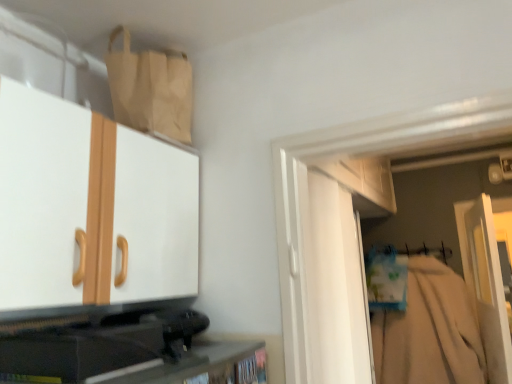
I want to click on white fabric hanger at right, so click(411, 251).

At what (x,y) coordinates should I click in order to perform the action: click on beige cotton robe at right. Please return your answer as a coordinate pair (x, y). Looking at the image, I should click on (429, 331).

This screenshot has width=512, height=384. What do you see at coordinates (197, 366) in the screenshot? I see `black plastic speaker at lower left, the 2th cabinetry from the top` at bounding box center [197, 366].

Measure the distance between black plastic speaker at lower left, acting as the first cabinetry starting from the bottom, and camera.

A distance of 29.51 inches exists between black plastic speaker at lower left, acting as the first cabinetry starting from the bottom, and camera.

Find the location of a particular element. The image size is (512, 384). white matte door at center is located at coordinates (485, 283).

The height and width of the screenshot is (384, 512). Identify the location of white fabric hanger at right. (411, 251).

From the image's perspective, between white matte door at center and black plastic speaker at lower left, acting as the first cabinetry starting from the bottom, who is located below?

white matte door at center.

Is white matte door at center smaller than black plastic speaker at lower left, acting as the first cabinetry starting from the bottom?

No, white matte door at center is not smaller than black plastic speaker at lower left, acting as the first cabinetry starting from the bottom.

What's the angular difference between white matte door at center and black plastic speaker at lower left, the 2th cabinetry from the top,'s facing directions?

The angle between the facing direction of white matte door at center and the facing direction of black plastic speaker at lower left, the 2th cabinetry from the top, is 5.94 degrees.

Does point (389, 249) appear closer or farther from the camera than point (196, 360)?

Point (389, 249).

From a real-world perspective, is white fabric hanger at right positioned over black plastic speaker at lower left, acting as the first cabinetry starting from the bottom, based on gravity?

Correct, in the physical world, white fabric hanger at right is higher than black plastic speaker at lower left, acting as the first cabinetry starting from the bottom.

Who is more distant, white fabric hanger at right or black plastic speaker at lower left, acting as the first cabinetry starting from the bottom?

white fabric hanger at right is further from the camera.

What's the angular difference between white fabric hanger at right and black plastic speaker at lower left, the 2th cabinetry from the top,'s facing directions?

90.8 degrees.

Would you say matte white cabinet at upper left, the 1th cabinetry in the top-to-bottom sequence, is inside or outside matte beige paper bag at upper left?

matte white cabinet at upper left, the 1th cabinetry in the top-to-bottom sequence, is outside matte beige paper bag at upper left.

Is matte white cabinet at upper left, the 1th cabinetry in the top-to-bottom sequence, facing away from matte beige paper bag at upper left?

No, matte beige paper bag at upper left is not at the back of matte white cabinet at upper left, the 1th cabinetry in the top-to-bottom sequence.

From a real-world perspective, which is physically below, matte white cabinet at upper left, which ranks as the 2th cabinetry in bottom-to-top order, or matte beige paper bag at upper left?

In real-world perspective, matte white cabinet at upper left, which ranks as the 2th cabinetry in bottom-to-top order, is lower.

You are a GUI agent. You are given a task and a screenshot of the screen. Output one action in this format:
    pyautogui.click(x=<x>, y=<y>)
    Task: Click on the hanger located underneath the matte beige paper bag at upper left (from a real-world perspective)
    The height and width of the screenshot is (384, 512).
    Given the screenshot: What is the action you would take?
    pyautogui.click(x=411, y=251)

Does white fabric hanger at right touch matte beige paper bag at upper left?

white fabric hanger at right and matte beige paper bag at upper left are clearly separated.

Can we say white fabric hanger at right lies outside matte beige paper bag at upper left?

Indeed, white fabric hanger at right is completely outside matte beige paper bag at upper left.

Is beige cotton robe at right further to camera compared to black plastic speaker at lower left, acting as the first cabinetry starting from the bottom?

Yes.

Is beige cotton robe at right not within black plastic speaker at lower left, acting as the first cabinetry starting from the bottom?

That's correct, beige cotton robe at right is outside of black plastic speaker at lower left, acting as the first cabinetry starting from the bottom.

From the picture: Which point is more distant from viewer, [408,293] or [209,353]?

The point [408,293] is farther.

Is beige cotton robe at right shorter than black plastic speaker at lower left, the 2th cabinetry from the top?

In fact, beige cotton robe at right may be taller than black plastic speaker at lower left, the 2th cabinetry from the top.

Image resolution: width=512 pixels, height=384 pixels. Find the location of `robe located in front of the white fabric hanger at right`. robe located in front of the white fabric hanger at right is located at coordinates (429, 331).

Is beige cotton robe at right oriented towards white fabric hanger at right?

No, beige cotton robe at right is not facing towards white fabric hanger at right.

Is there a large distance between beige cotton robe at right and white fabric hanger at right?

That's not correct — beige cotton robe at right is a little close to white fabric hanger at right.

From a real-world perspective, is matte beige paper bag at upper left positioned over white fabric hanger at right based on gravity?

Indeed, from a real-world perspective, matte beige paper bag at upper left stands above white fabric hanger at right.

Visually, is matte beige paper bag at upper left positioned to the left or to the right of white fabric hanger at right?

In the image, matte beige paper bag at upper left appears on the left side of white fabric hanger at right.

From the image's perspective, between matte beige paper bag at upper left and white fabric hanger at right, which one is located above?

matte beige paper bag at upper left, from the image's perspective.

Which cabinetry is the 1st one when counting from the front of the white matte door at center? Please provide its 2D coordinates.

[(197, 366)]

I want to click on hanger on the right of black plastic speaker at lower left, the 2th cabinetry from the top, so click(411, 251).

From the image, which object appears to be nearer to matte beige paper bag at upper left, beige cotton robe at right or white fabric hanger at right?

white fabric hanger at right is closer to matte beige paper bag at upper left.

When comparing their distances from matte white cabinet at upper left, the 1th cabinetry in the top-to-bottom sequence, does white fabric hanger at right or beige cotton robe at right seem closer?

beige cotton robe at right.

Estimate the real-world distances between objects in this image. Which object is further from black plastic speaker at lower left, acting as the first cabinetry starting from the bottom, white matte door at center or white fabric hanger at right?

white fabric hanger at right is further to black plastic speaker at lower left, acting as the first cabinetry starting from the bottom.

In the scene shown: Considering their positions, is black plastic speaker at lower left, acting as the first cabinetry starting from the bottom, positioned closer to white matte door at center than matte beige paper bag at upper left?

black plastic speaker at lower left, acting as the first cabinetry starting from the bottom, is closer to white matte door at center.

From the image, which object appears to be farther from black plastic speaker at lower left, acting as the first cabinetry starting from the bottom, matte beige paper bag at upper left or matte white cabinet at upper left, which ranks as the 2th cabinetry in bottom-to-top order?

The object further to black plastic speaker at lower left, acting as the first cabinetry starting from the bottom, is matte beige paper bag at upper left.

Considering their positions, is matte white cabinet at upper left, which ranks as the 2th cabinetry in bottom-to-top order, positioned further to white matte door at center than white fabric hanger at right?

matte white cabinet at upper left, which ranks as the 2th cabinetry in bottom-to-top order, lies further to white matte door at center than the other object.

Estimate the real-world distances between objects in this image. Which object is closer to white fabric hanger at right, matte beige paper bag at upper left or white matte door at center?

white matte door at center is positioned closer to the anchor white fabric hanger at right.

From the image, which object appears to be farther from black plastic speaker at lower left, acting as the first cabinetry starting from the bottom, matte white cabinet at upper left, which ranks as the 2th cabinetry in bottom-to-top order, or beige cotton robe at right?

beige cotton robe at right.

This screenshot has height=384, width=512. Find the location of `door between matte white cabinet at upper left, the 1th cabinetry in the top-to-bottom sequence, and white fabric hanger at right from front to back`. door between matte white cabinet at upper left, the 1th cabinetry in the top-to-bottom sequence, and white fabric hanger at right from front to back is located at coordinates (485, 283).

The height and width of the screenshot is (384, 512). I want to click on robe located between black plastic speaker at lower left, the 2th cabinetry from the top, and white matte door at center in the left-right direction, so click(429, 331).

At what (x,y) coordinates should I click in order to perform the action: click on paper bag between matte white cabinet at upper left, the 1th cabinetry in the top-to-bottom sequence, and white matte door at center from left to right. Please return your answer as a coordinate pair (x, y). This screenshot has width=512, height=384. Looking at the image, I should click on (150, 90).

Locate an element on the screen. The image size is (512, 384). paper bag between matte white cabinet at upper left, the 1th cabinetry in the top-to-bottom sequence, and white fabric hanger at right in the front-back direction is located at coordinates (150, 90).